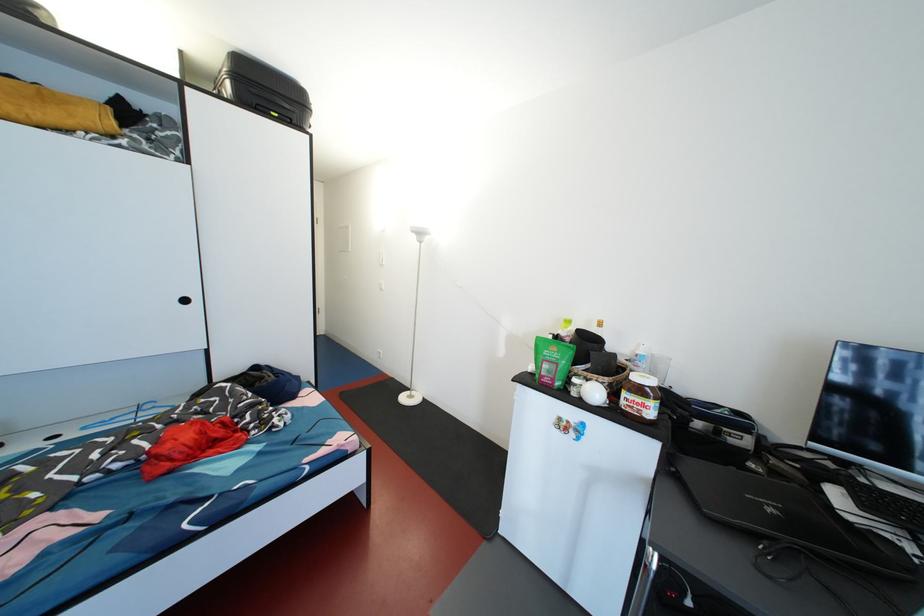
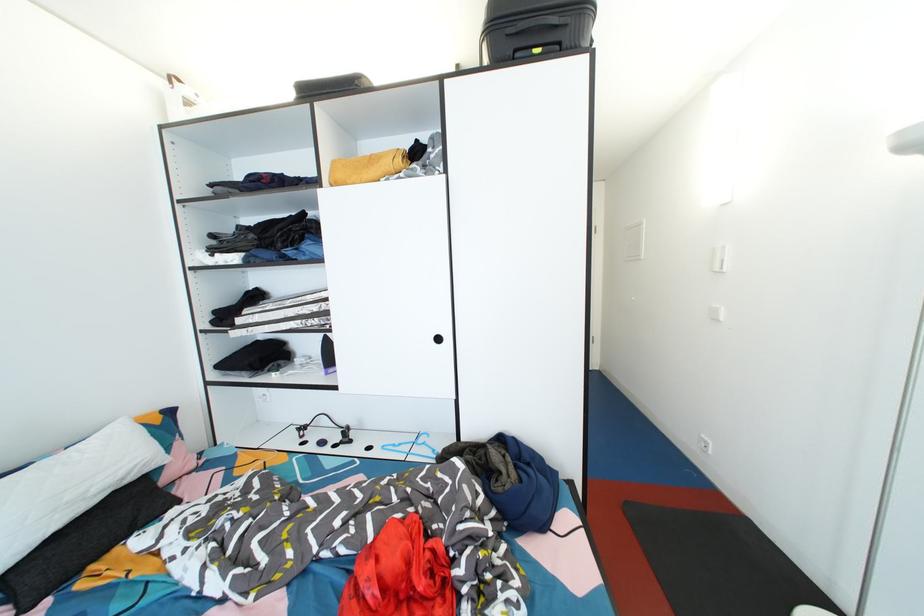
Question: The camera is either moving clockwise (left) or counter-clockwise (right) around the object. The first image is from the beginning of the video and the second image is from the end. Is the camera moving left or right when shooting the video?

Choices:
 (A) Left
 (B) Right

Answer: (B)